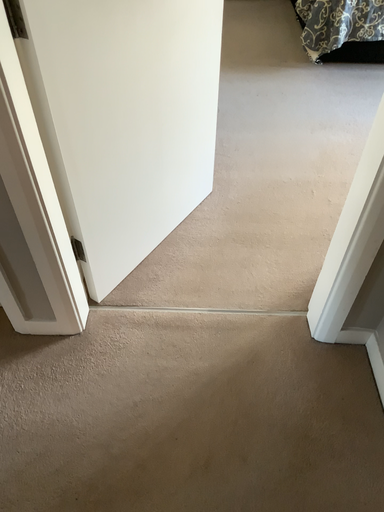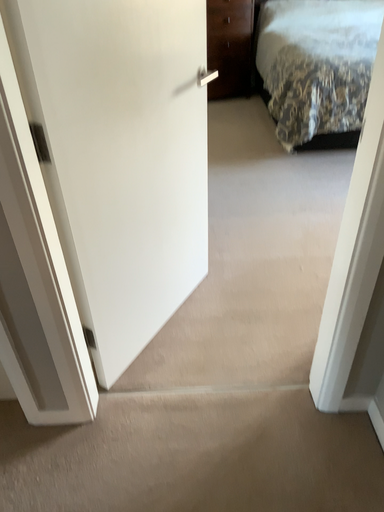
Question: How did the camera likely rotate when shooting the video?

Choices:
 (A) rotated upward
 (B) rotated downward

Answer: (A)